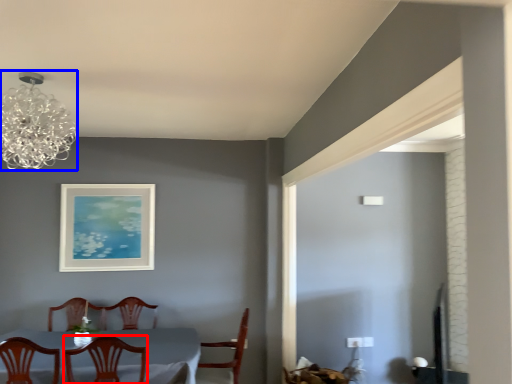
Question: Which object appears closest to the camera in this image, chair (highlighted by a red box) or lamp (highlighted by a blue box)?

Choices:
 (A) chair
 (B) lamp

Answer: (B)